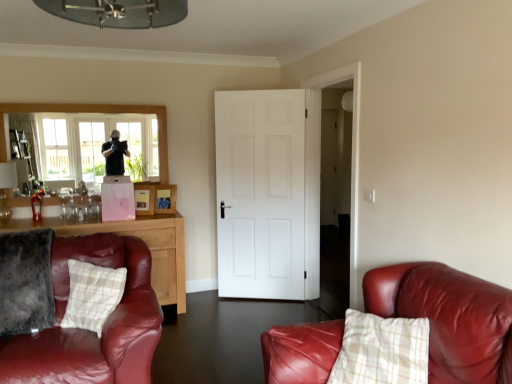
What do you see at coordinates (449, 318) in the screenshot?
I see `leather couch at right` at bounding box center [449, 318].

Find the location of `velvety gray pillow at lower left, the first pillow from the left`. velvety gray pillow at lower left, the first pillow from the left is located at coordinates (26, 282).

Describe the element at coordinates (268, 193) in the screenshot. The height and width of the screenshot is (384, 512). I see `white matte door at center` at that location.

The image size is (512, 384). What are the coordinates of `plaid fabric pillow at lower left, acting as the 1th pillow starting from the right` in the screenshot? It's located at (92, 295).

Locate an element on the screen. The height and width of the screenshot is (384, 512). clear glass window at upper left is located at coordinates (96, 137).

From a real-world perspective, is leather couch at right above or below plaid fabric pillow at lower left, acting as the 1th pillow starting from the right?

From a real-world perspective, leather couch at right is physically below plaid fabric pillow at lower left, acting as the 1th pillow starting from the right.

From the image's perspective, which is below, leather couch at right or plaid fabric pillow at lower left, the 2th pillow from the left?

leather couch at right is shown below in the image.

How different are the orientations of leather couch at right and plaid fabric pillow at lower left, the 2th pillow from the left, in degrees?

They differ by 8.68 degrees in their facing directions.

Looking at this image, can you confirm if leather couch at right is smaller than plaid fabric pillow at lower left, acting as the 1th pillow starting from the right?

Actually, leather couch at right might be larger than plaid fabric pillow at lower left, acting as the 1th pillow starting from the right.

Measure the distance between velvety gray pillow at lower left, marked as the 2th pillow in a right-to-left arrangement, and leather couch at right.

velvety gray pillow at lower left, marked as the 2th pillow in a right-to-left arrangement, is 5.66 feet away from leather couch at right.

Considering the relative positions of velvety gray pillow at lower left, marked as the 2th pillow in a right-to-left arrangement, and leather couch at right in the image provided, is velvety gray pillow at lower left, marked as the 2th pillow in a right-to-left arrangement, to the left of leather couch at right from the viewer's perspective?

Yes.

Would you consider velvety gray pillow at lower left, marked as the 2th pillow in a right-to-left arrangement, to be distant from leather couch at right?

Yes, velvety gray pillow at lower left, marked as the 2th pillow in a right-to-left arrangement, and leather couch at right are quite far apart.

Can you confirm if matte brown cabinet at left is shorter than velvety gray pillow at lower left, marked as the 2th pillow in a right-to-left arrangement?

No, matte brown cabinet at left is not shorter than velvety gray pillow at lower left, marked as the 2th pillow in a right-to-left arrangement.

Consider the image. Considering the sizes of matte brown cabinet at left and velvety gray pillow at lower left, the first pillow from the left, in the image, is matte brown cabinet at left wider or thinner than velvety gray pillow at lower left, the first pillow from the left,?

Considering their sizes, matte brown cabinet at left looks slimmer than velvety gray pillow at lower left, the first pillow from the left.

From the image's perspective, is matte brown cabinet at left over velvety gray pillow at lower left, marked as the 2th pillow in a right-to-left arrangement?

Actually, matte brown cabinet at left appears below velvety gray pillow at lower left, marked as the 2th pillow in a right-to-left arrangement, in the image.

Which object is further away from the camera, matte brown cabinet at left or velvety gray pillow at lower left, the first pillow from the left?

matte brown cabinet at left is further from the camera.

Would you say leather couch at right is inside or outside velvety gray pillow at lower left, the first pillow from the left?

leather couch at right exists outside the volume of velvety gray pillow at lower left, the first pillow from the left.

From the image's perspective, which is above, leather couch at right or velvety gray pillow at lower left, the first pillow from the left?

velvety gray pillow at lower left, the first pillow from the left, appears higher in the image.

Is leather couch at right oriented away from velvety gray pillow at lower left, the first pillow from the left?

No, leather couch at right's orientation is not away from velvety gray pillow at lower left, the first pillow from the left.

Is leather couch at right far from velvety gray pillow at lower left, marked as the 2th pillow in a right-to-left arrangement?

That's right, there is a large distance between leather couch at right and velvety gray pillow at lower left, marked as the 2th pillow in a right-to-left arrangement.

Relative to clear glass window at upper left, is matte brown cabinet at left in front or behind?

Visually, matte brown cabinet at left is located in front of clear glass window at upper left.

Considering the relative sizes of matte brown cabinet at left and clear glass window at upper left in the image provided, is matte brown cabinet at left thinner than clear glass window at upper left?

Incorrect, the width of matte brown cabinet at left is not less than that of clear glass window at upper left.

Are matte brown cabinet at left and clear glass window at upper left beside each other?

No, matte brown cabinet at left is not touching clear glass window at upper left.

From a real-world perspective, is matte brown cabinet at left beneath clear glass window at upper left?

Yes, from a real-world perspective, matte brown cabinet at left is beneath clear glass window at upper left.

In terms of height, does clear glass window at upper left look taller or shorter compared to leather couch at right?

Clearly, clear glass window at upper left is taller compared to leather couch at right.

Identify the location of studio couch in front of the clear glass window at upper left. The image size is (512, 384). (449, 318).

Based on their sizes in the image, would you say clear glass window at upper left is bigger or smaller than leather couch at right?

Considering their sizes, clear glass window at upper left takes up more space than leather couch at right.

Can you tell me how much plaid fabric pillow at lower left, acting as the 1th pillow starting from the right, and clear glass window at upper left differ in facing direction?

There is a 48.2-degree angle between the facing directions of plaid fabric pillow at lower left, acting as the 1th pillow starting from the right, and clear glass window at upper left.

Measure the distance from plaid fabric pillow at lower left, the 2th pillow from the left, to clear glass window at upper left.

5.74 feet.

Is point (79, 277) positioned after point (45, 158)?

No, it is in front of (45, 158).

Is plaid fabric pillow at lower left, acting as the 1th pillow starting from the right, further to camera compared to clear glass window at upper left?

No, it is in front of clear glass window at upper left.

Locate an element on the screen. The image size is (512, 384). the 1st pillow positioned above the leather couch at right (from the image's perspective) is located at coordinates point(92,295).

The height and width of the screenshot is (384, 512). I want to click on studio couch below the velvety gray pillow at lower left, the first pillow from the left (from the image's perspective), so click(x=449, y=318).

Estimate the real-world distances between objects in this image. Which object is closer to leather couch at right, clear glass window at upper left or velvety gray pillow at lower left, the first pillow from the left?

velvety gray pillow at lower left, the first pillow from the left, is closer to leather couch at right.

From the image, which object appears to be nearer to plaid fabric pillow at lower left, acting as the 1th pillow starting from the right, matte brown cabinet at left or velvety gray pillow at lower left, the first pillow from the left?

velvety gray pillow at lower left, the first pillow from the left.

From the image, which object appears to be farther from matte brown cabinet at left, plaid fabric pillow at lower left, acting as the 1th pillow starting from the right, or clear glass window at upper left?

Among the two, plaid fabric pillow at lower left, acting as the 1th pillow starting from the right, is located further to matte brown cabinet at left.

Looking at the image, which one is located closer to plaid fabric pillow at lower left, acting as the 1th pillow starting from the right, matte brown cabinet at left or clear glass window at upper left?

matte brown cabinet at left.

Considering their positions, is velvety gray pillow at lower left, marked as the 2th pillow in a right-to-left arrangement, positioned further to matte brown cabinet at left than leather couch at right?

Among the two, leather couch at right is located further to matte brown cabinet at left.

Looking at the image, which one is located closer to white matte door at center, matte brown cabinet at left or leather couch at right?

Among the two, matte brown cabinet at left is located nearer to white matte door at center.

Considering their positions, is clear glass window at upper left positioned further to white matte door at center than leather couch at right?

leather couch at right lies further to white matte door at center than the other object.

Which object lies nearer to the anchor point matte brown cabinet at left, white matte door at center or velvety gray pillow at lower left, the first pillow from the left?

white matte door at center.

I want to click on cabinetry between clear glass window at upper left and leather couch at right, so click(140, 238).

Find the location of `pillow located between velvety gray pillow at lower left, the first pillow from the left, and matte brown cabinet at left in the depth direction`. pillow located between velvety gray pillow at lower left, the first pillow from the left, and matte brown cabinet at left in the depth direction is located at coordinates (92, 295).

The width and height of the screenshot is (512, 384). What are the coordinates of `pillow situated between matte brown cabinet at left and leather couch at right from left to right` in the screenshot? It's located at (92, 295).

You are a GUI agent. You are given a task and a screenshot of the screen. Output one action in this format:
    pyautogui.click(x=<x>, y=<y>)
    Task: Click on the pillow situated between matte brown cabinet at left and white matte door at center from left to right
    Image resolution: width=512 pixels, height=384 pixels.
    Given the screenshot: What is the action you would take?
    pyautogui.click(x=92, y=295)